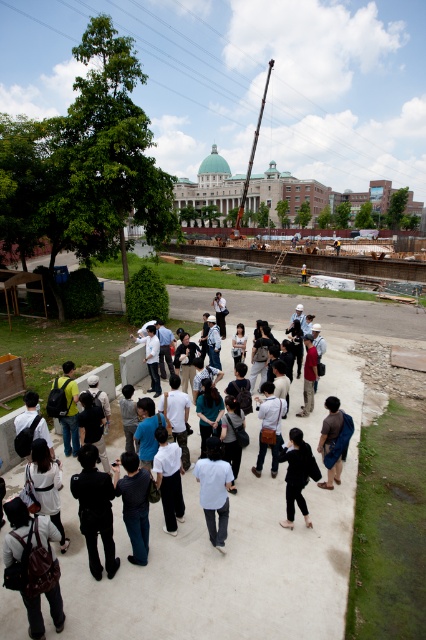
You are standing at the construction site and want to place a safety barrier between the two points, point (287, 476) and point (328, 480). Which point should the barrier be closer to in order to block the path towards the building?

The barrier should be closer to point (287, 476) because it is closer to the camera, meaning it is in front of point (328, 480). Placing the barrier closer to the nearer point would effectively block the path towards the building.